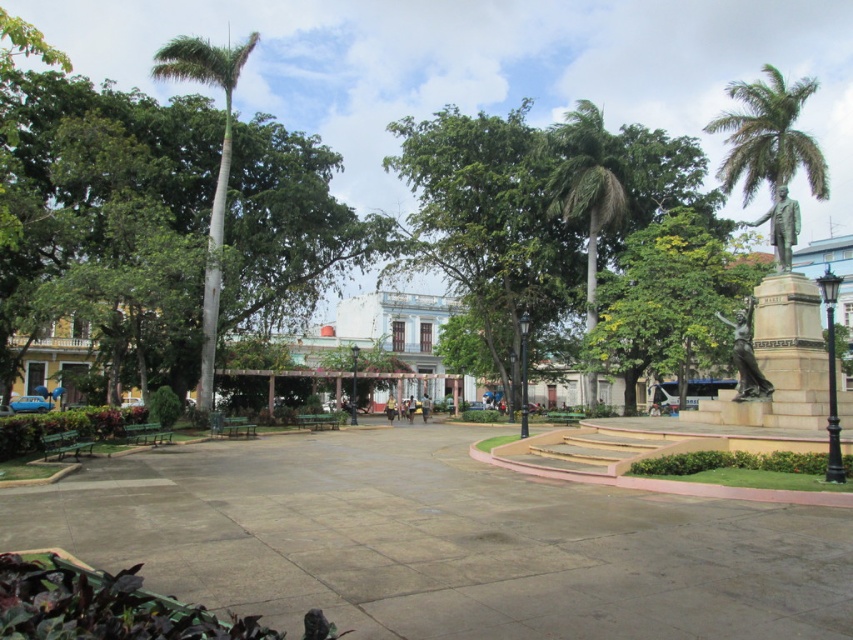
You are a tourist standing in the public square facing the statue. You want to take a photo that includes both the green leafy palm tree at upper right and the green smooth palm tree at left. Which palm tree should you position yourself closer to in order to capture both in the frame?

You should position yourself closer to the green smooth palm tree at left because the green leafy palm tree at upper right is to the right of it, allowing both to be included in the frame when you are near the left palm tree.